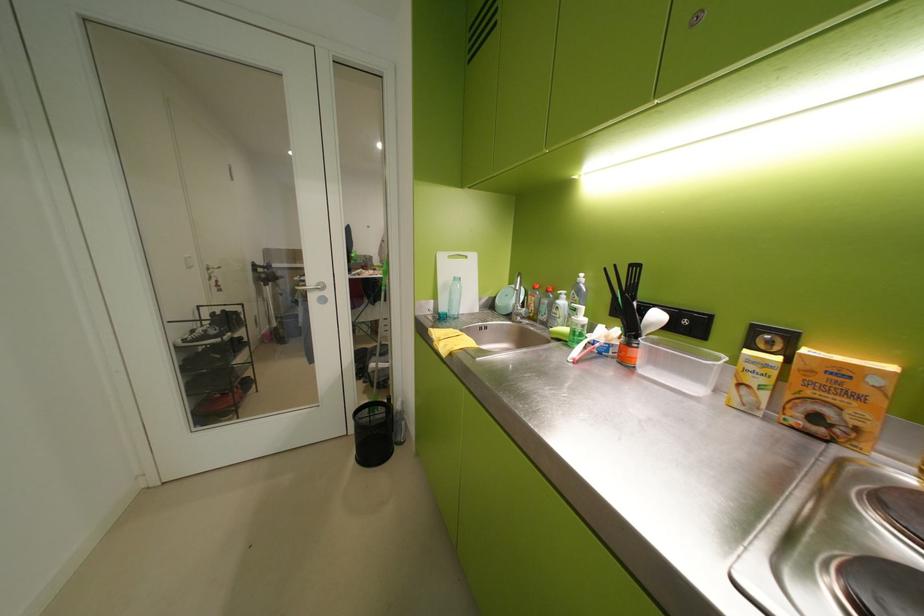
Locate an element on the screen. The image size is (924, 616). clear plastic container is located at coordinates (678, 365).